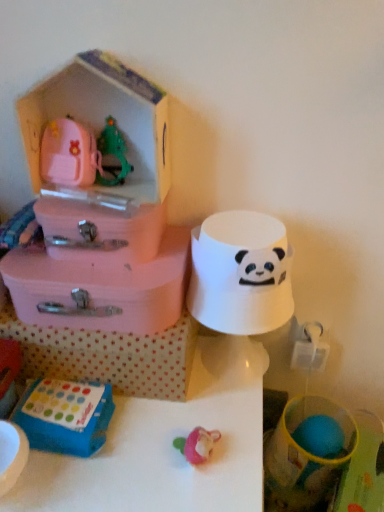
Locate an element on the screen. The height and width of the screenshot is (512, 384). vacant space underneath pink plastic toy house at upper left, the fourth storage box when ordered from bottom to top (from a real-world perspective) is located at coordinates [107, 202].